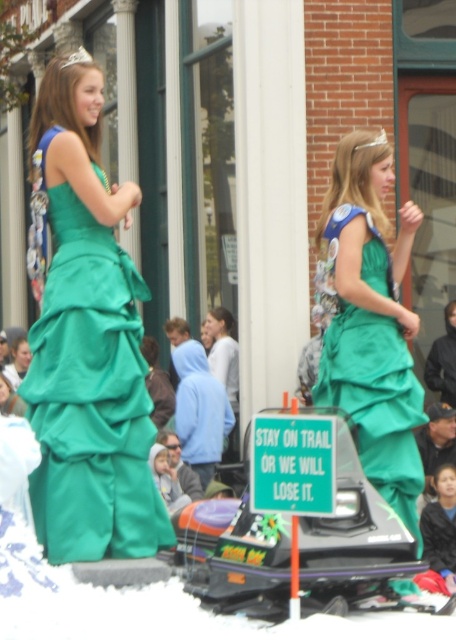
Question: Is emerald satin dress at left smaller than green satin dress at center?

Choices:
 (A) no
 (B) yes

Answer: (B)

Question: Does emerald satin dress at left appear over green satin dress at center?

Choices:
 (A) yes
 (B) no

Answer: (A)

Question: Does emerald satin dress at left appear on the right side of green satin dress at center?

Choices:
 (A) yes
 (B) no

Answer: (B)